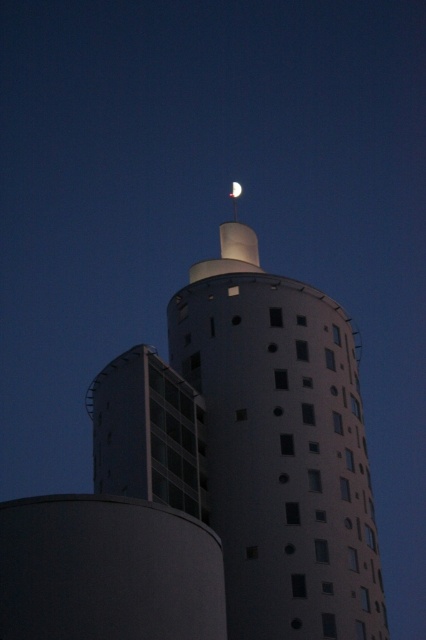
Question: Observing the image, what is the correct spatial positioning of white matte tower at upper center in reference to silver metallic moon at upper center?

Choices:
 (A) below
 (B) above

Answer: (A)

Question: Where is white matte tower at upper center located in relation to silver metallic moon at upper center in the image?

Choices:
 (A) left
 (B) right

Answer: (B)

Question: Does white matte tower at upper center have a smaller size compared to silver metallic moon at upper center?

Choices:
 (A) yes
 (B) no

Answer: (B)

Question: Which object is farther from the camera taking this photo?

Choices:
 (A) silver metallic moon at upper center
 (B) white matte tower at upper center

Answer: (A)

Question: Which point is closer to the camera taking this photo?

Choices:
 (A) (235, 186)
 (B) (322, 458)

Answer: (B)

Question: Which of the following is the closest to the observer?

Choices:
 (A) (301, 388)
 (B) (241, 188)

Answer: (A)